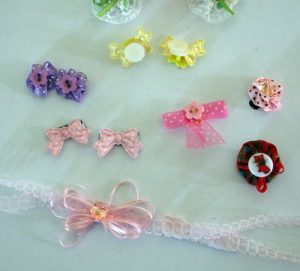
Where is `doiley`? The image size is (300, 271). doiley is located at coordinates (211, 17), (120, 13).